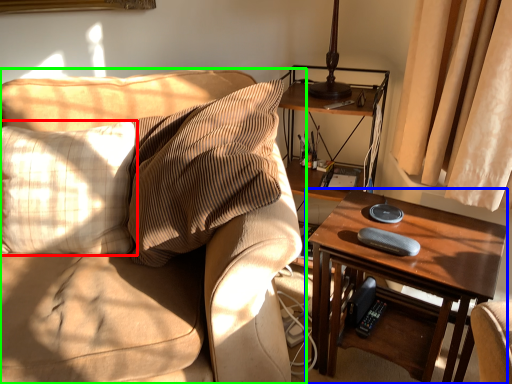
Question: Which object is positioned closest to pillow (highlighted by a red box)? Select from table (highlighted by a blue box) and studio couch (highlighted by a green box).

Choices:
 (A) table
 (B) studio couch

Answer: (B)